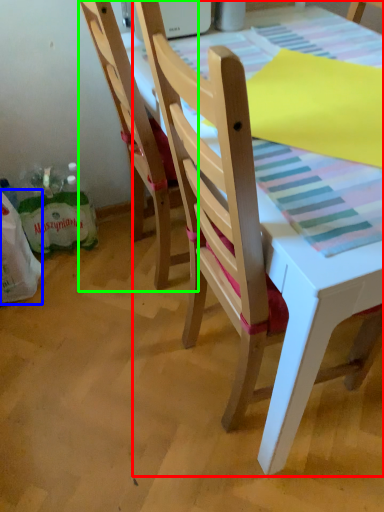
Question: Which is farther away from chair (highlighted by a red box)? grocery bag (highlighted by a blue box) or chair (highlighted by a green box)?

Choices:
 (A) grocery bag
 (B) chair

Answer: (A)